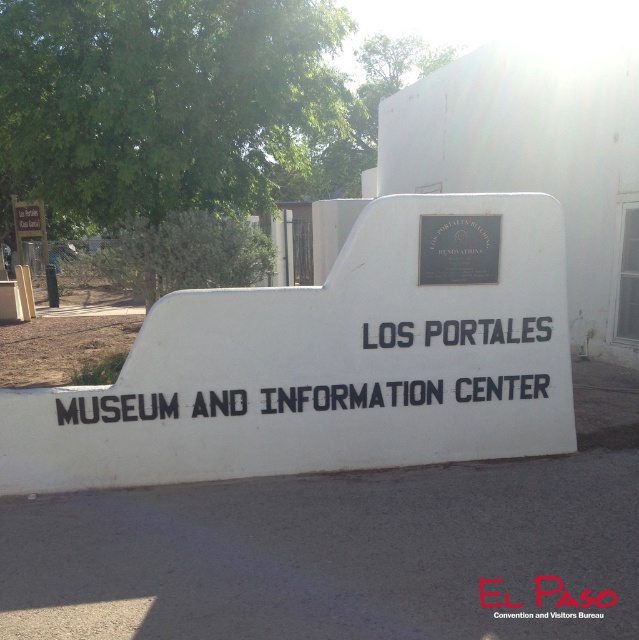
Question: Where is blackmaterial/texturesign at center located in relation to metallic plaque at center in the image?

Choices:
 (A) above
 (B) below

Answer: (B)

Question: Which point is closer to the camera taking this photo?

Choices:
 (A) 479,273
 (B) 233,410
 (C) 82,413

Answer: (C)

Question: Is blackmaterial/texturesign at center below metallic plaque at center?

Choices:
 (A) yes
 (B) no

Answer: (A)

Question: Does white matte sign at center have a larger size compared to blackmaterial/texturesign at center?

Choices:
 (A) yes
 (B) no

Answer: (A)

Question: Among these points, which one is nearest to the camera?

Choices:
 (A) (104, 416)
 (B) (470, 244)
 (C) (534, 214)

Answer: (A)

Question: Among these points, which one is farthest from the camera?

Choices:
 (A) (238, 333)
 (B) (385, 348)
 (C) (489, 246)

Answer: (C)